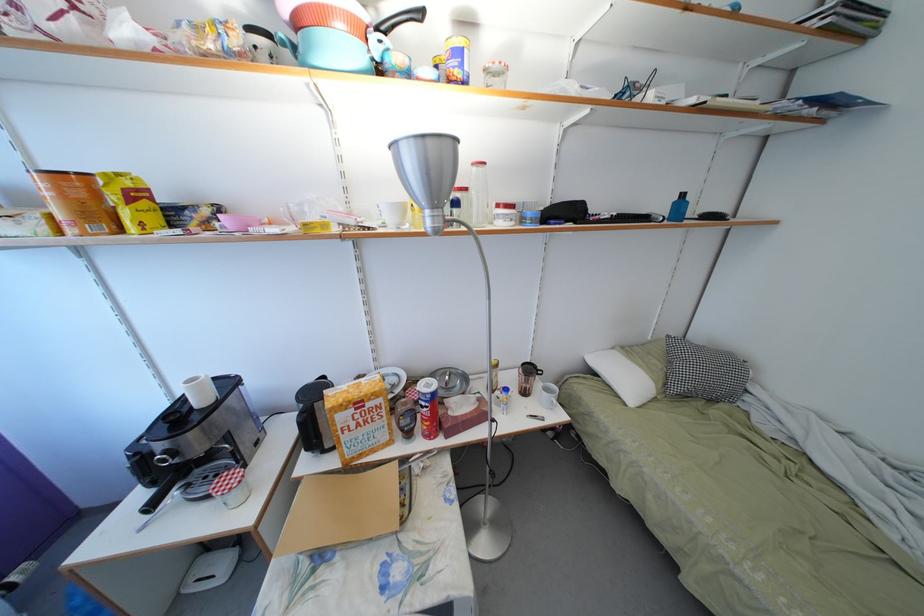
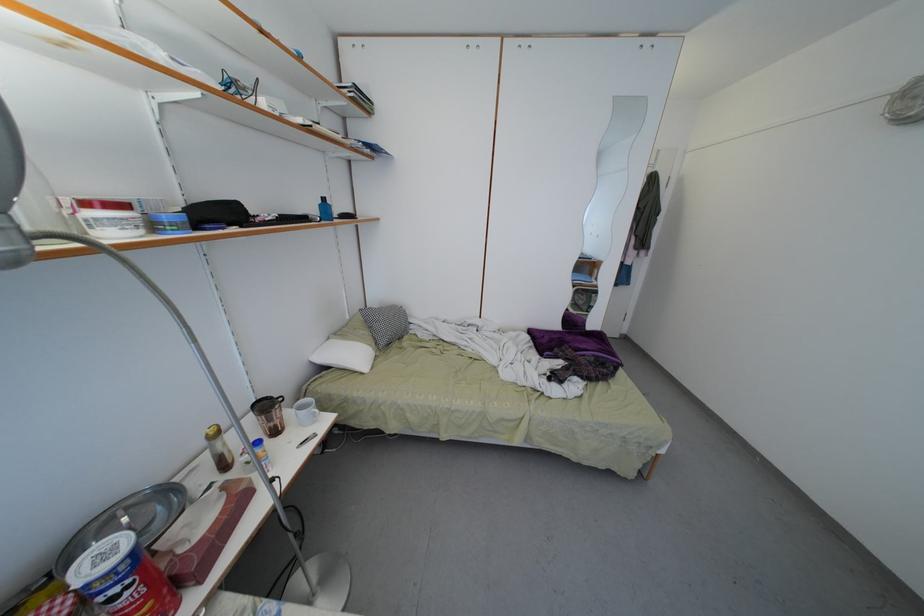
Find the pixel in the second image that matches (x=688, y=201) in the first image.

(330, 205)